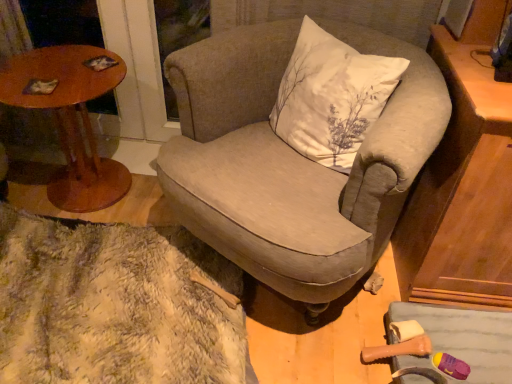
In the scene shown: Measure the distance between point (83, 120) and camera.

They are 5.54 feet apart.

Describe the element at coordinates (71, 118) in the screenshot. I see `wooden round table at left` at that location.

What do you see at coordinates (116, 306) in the screenshot? The image size is (512, 384). I see `fuzzy beige rug at lower left` at bounding box center [116, 306].

At what (x,y) coordinates should I click in order to perform the action: click on white cotton pillow at center. Please return your answer as a coordinate pair (x, y). Looking at the image, I should click on (331, 97).

Identify the location of matte brown cabinet at right. The width and height of the screenshot is (512, 384). (464, 180).

Is matte brown cabinet at right not within fuzzy beige rug at lower left?

Yes, matte brown cabinet at right is not within fuzzy beige rug at lower left.

Is matte brown cabinet at right further to the viewer compared to fuzzy beige rug at lower left?

No, matte brown cabinet at right is closer to the camera.

Can you confirm if matte brown cabinet at right is bigger than fuzzy beige rug at lower left?

Correct, matte brown cabinet at right is larger in size than fuzzy beige rug at lower left.

Between fuzzy beige rug at lower left and wooden round table at left, which one appears on the left side from the viewer's perspective?

wooden round table at left is more to the left.

Is fuzzy beige rug at lower left spatially inside wooden round table at left, or outside of it?

fuzzy beige rug at lower left cannot be found inside wooden round table at left.

Is fuzzy beige rug at lower left facing towards wooden round table at left?

No, fuzzy beige rug at lower left is not turned towards wooden round table at left.

Find the location of a particular element. The image size is (512, 384). blanket on the right of wooden round table at left is located at coordinates (116, 306).

Which point is more distant from viewer, (58,207) or (298,150)?

The point (58,207) is farther.

From a real-world perspective, between wooden round table at left and white cotton pillow at center, who is vertically higher?

In real-world perspective, white cotton pillow at center is above.

From the image's perspective, does wooden round table at left appear lower than white cotton pillow at center?

Indeed, from the image's perspective, wooden round table at left is shown beneath white cotton pillow at center.

Looking at the image, does white cotton pillow at center seem bigger or smaller compared to wooden round table at left?

white cotton pillow at center is smaller than wooden round table at left.

Is point (320, 40) closer or farther from the camera than point (105, 50)?

Point (320, 40) is closer to the camera than point (105, 50).

Which object is wider, white cotton pillow at center or wooden round table at left?

Wider between the two is wooden round table at left.

Which of these two, matte brown cabinet at right or white cotton pillow at center, is wider?

Wider between the two is matte brown cabinet at right.

Measure the distance between matte brown cabinet at right and white cotton pillow at center.

They are 12.35 inches apart.

Where is `cabinetry directly beneath the white cotton pillow at center (from a real-world perspective)`? cabinetry directly beneath the white cotton pillow at center (from a real-world perspective) is located at coordinates pyautogui.click(x=464, y=180).

Is wooden round table at left not close to fuzzy beige rug at lower left?

wooden round table at left is near fuzzy beige rug at lower left, not far away.

Measure the distance between wooden round table at left and fuzzy beige rug at lower left.

wooden round table at left and fuzzy beige rug at lower left are 19.36 inches apart.

Is the depth of wooden round table at left greater than that of fuzzy beige rug at lower left?

Yes, it is behind fuzzy beige rug at lower left.

Does wooden round table at left have a smaller size compared to fuzzy beige rug at lower left?

Yes.

Is white cotton pillow at center positioned beyond the bounds of textured beige armchair at center?

No.

Is white cotton pillow at center shorter than textured beige armchair at center?

Indeed, white cotton pillow at center has a lesser height compared to textured beige armchair at center.

Could you tell me if white cotton pillow at center is facing textured beige armchair at center?

Yes, white cotton pillow at center faces towards textured beige armchair at center.

From the image's perspective, is white cotton pillow at center above or below textured beige armchair at center?

Based on their image positions, white cotton pillow at center is located above textured beige armchair at center.

Image resolution: width=512 pixels, height=384 pixels. What are the coordinates of `cabinetry in front of the fuzzy beige rug at lower left` in the screenshot? It's located at (464, 180).

This screenshot has height=384, width=512. Find the location of `table above the fuzzy beige rug at lower left (from the image's perspective)`. table above the fuzzy beige rug at lower left (from the image's perspective) is located at coordinates (71, 118).

Looking at the image, which one is located closer to wooden round table at left, white cotton pillow at center or matte brown cabinet at right?

white cotton pillow at center lies closer to wooden round table at left than the other object.

From the picture: From the image, which object appears to be nearer to matte brown cabinet at right, white cotton pillow at center or wooden round table at left?

white cotton pillow at center is positioned closer to the anchor matte brown cabinet at right.

Which object lies further to the anchor point wooden round table at left, fuzzy beige rug at lower left or white cotton pillow at center?

white cotton pillow at center lies further to wooden round table at left than the other object.

Considering their positions, is textured beige armchair at center positioned closer to matte brown cabinet at right than fuzzy beige rug at lower left?

textured beige armchair at center.

Based on their spatial positions, is fuzzy beige rug at lower left or wooden round table at left closer to white cotton pillow at center?

Based on the image, fuzzy beige rug at lower left appears to be nearer to white cotton pillow at center.

Based on their spatial positions, is fuzzy beige rug at lower left or wooden round table at left closer to matte brown cabinet at right?

fuzzy beige rug at lower left is closer to matte brown cabinet at right.

Considering their positions, is wooden round table at left positioned closer to textured beige armchair at center than matte brown cabinet at right?

Among the two, matte brown cabinet at right is located nearer to textured beige armchair at center.

Based on their spatial positions, is matte brown cabinet at right or textured beige armchair at center closer to fuzzy beige rug at lower left?

Based on the image, textured beige armchair at center appears to be nearer to fuzzy beige rug at lower left.

This screenshot has height=384, width=512. In order to click on pillow between wooden round table at left and matte brown cabinet at right in this screenshot , I will do click(331, 97).

What are the coordinates of `chair between fuzzy beige rug at lower left and white cotton pillow at center` in the screenshot? It's located at (292, 162).

In order to click on pillow situated between fuzzy beige rug at lower left and matte brown cabinet at right from left to right in this screenshot , I will do `click(331, 97)`.

At what (x,y) coordinates should I click in order to perform the action: click on blanket situated between wooden round table at left and white cotton pillow at center from left to right. Please return your answer as a coordinate pair (x, y). Looking at the image, I should click on (116, 306).